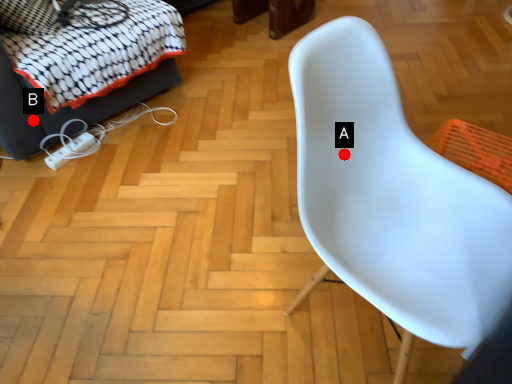
Question: Two points are circled on the image, labeled by A and B beside each circle. Among these points, which one is farthest from the camera?

Choices:
 (A) A is further
 (B) B is further

Answer: (B)